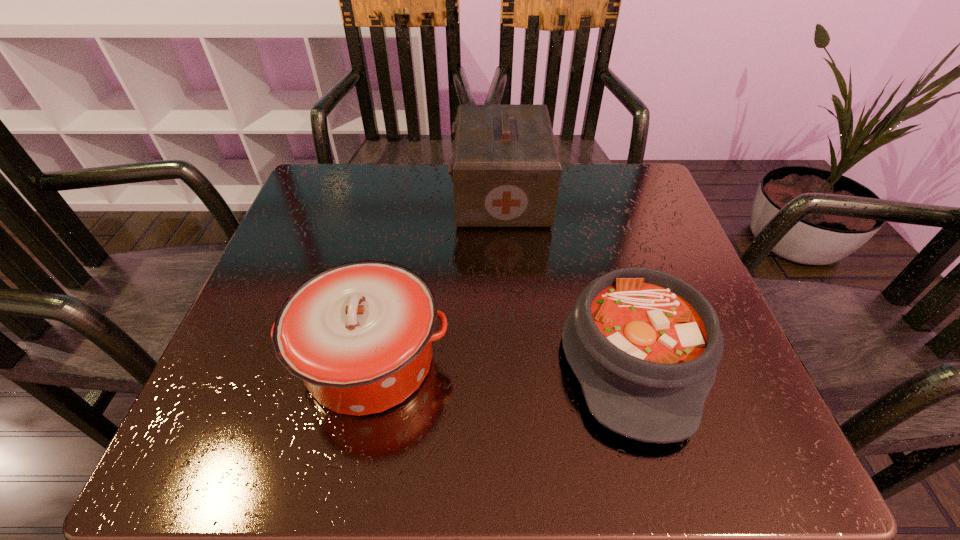
Find the location of a particular element. The width and height of the screenshot is (960, 540). the tallest object is located at coordinates (505, 168).

This screenshot has height=540, width=960. What are the coordinates of `the first-aid kit` in the screenshot? It's located at (505, 168).

Locate an element on the screen. The image size is (960, 540). the taller casserole is located at coordinates (359, 334).

At what (x,y) coordinates should I click in order to perform the action: click on the left casserole. Please return your answer as a coordinate pair (x, y). Looking at the image, I should click on (359, 334).

At what (x,y) coordinates should I click in order to perform the action: click on the right casserole. Please return your answer as a coordinate pair (x, y). The width and height of the screenshot is (960, 540). Looking at the image, I should click on (645, 345).

At what (x,y) coordinates should I click in order to perform the action: click on the shorter casserole. Please return your answer as a coordinate pair (x, y). Looking at the image, I should click on (645, 345).

Where is `free space located 0.250m on the front of the farthest object`? The image size is (960, 540). free space located 0.250m on the front of the farthest object is located at coordinates click(x=509, y=316).

Locate an element on the screen. free space located on the left of the left casserole is located at coordinates (220, 361).

Identify the location of free spot located 0.370m on the left of the shorter casserole. Image resolution: width=960 pixels, height=540 pixels. 345,354.

Where is `object situated at the far edge`? This screenshot has height=540, width=960. object situated at the far edge is located at coordinates (505, 168).